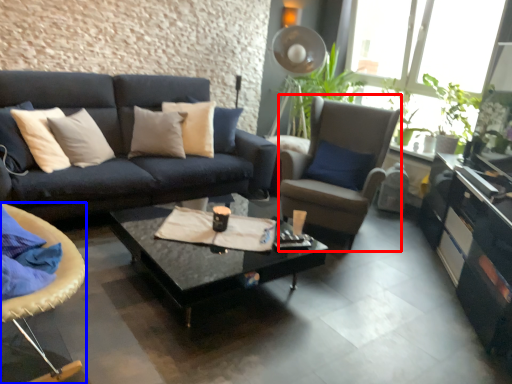
Question: Which of the following is the closest to the observer, chair (highlighted by a red box) or chair (highlighted by a blue box)?

Choices:
 (A) chair
 (B) chair

Answer: (B)